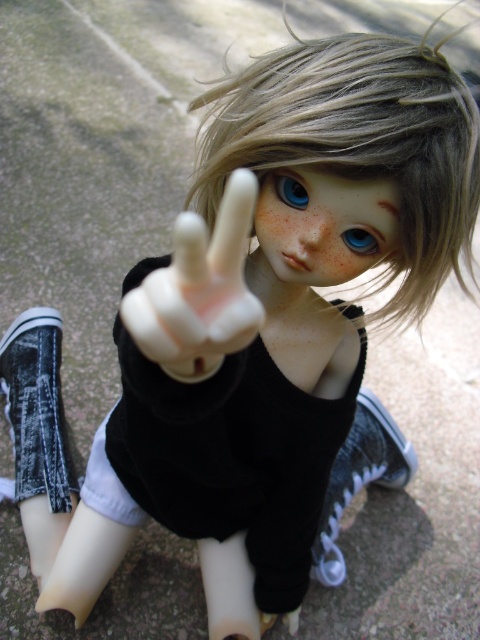
Is blondehair at center further to camera compared to blue glossy eye at upper center?

No, blondehair at center is closer to the viewer.

Does point (322, 51) lie behind point (288, 188)?

No.

What do you see at coordinates (359, 144) in the screenshot?
I see `blondehair at center` at bounding box center [359, 144].

Identify the location of blondehair at center. (359, 144).

How distant is blue glossy eye at upper center from blue glossy eye at center?

blue glossy eye at upper center and blue glossy eye at center are 2.28 inches apart from each other.

Between blue glossy eye at upper center and blue glossy eye at center, which one appears on the right side from the viewer's perspective?

Positioned to the right is blue glossy eye at center.

Identify the location of blue glossy eye at upper center. The width and height of the screenshot is (480, 640). (289, 189).

The image size is (480, 640). Identify the location of blue glossy eye at upper center. (289, 189).

Who is more distant from viewer, (251,122) or (279,560)?

Positioned behind is point (279,560).

Is blondehair at center thinner than black matte dress at center?

Yes, blondehair at center is thinner than black matte dress at center.

Where is `blondehair at center`? blondehair at center is located at coordinates (359, 144).

You are a GUI agent. You are given a task and a screenshot of the screen. Output one action in this format:
    pyautogui.click(x=<x>, y=<y>)
    Task: Click on the blondehair at center
    This screenshot has height=640, width=480.
    Given the screenshot: What is the action you would take?
    pyautogui.click(x=359, y=144)